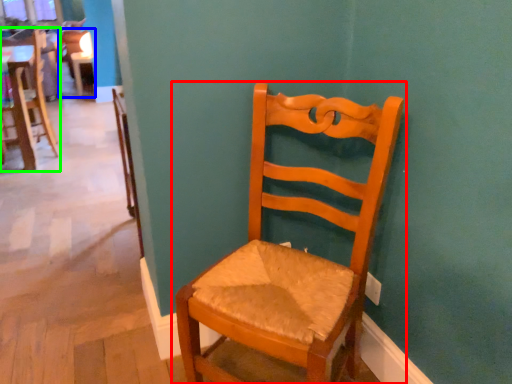
Question: Based on their relative distances, which object is farther from chair (highlighted by a red box)? Choose from chair (highlighted by a blue box) and chair (highlighted by a green box).

Choices:
 (A) chair
 (B) chair

Answer: (A)